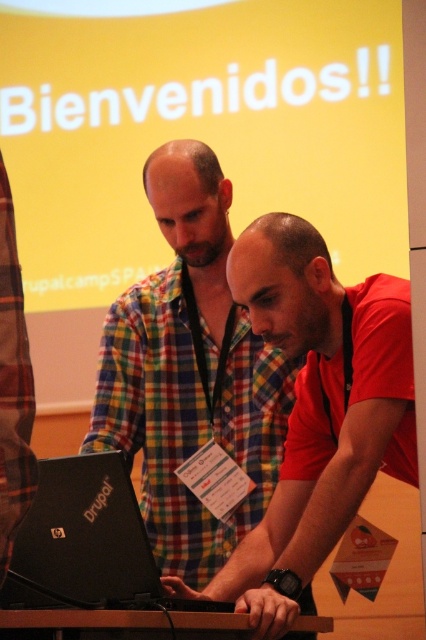
You are standing in the conference room and need to move from point A to point B. The points are labeled as point (414,442) and point (199,624). Which point is closer to you?

Point (414,442) is further to the viewer than point (199,624), so point (199,624) is closer to you.